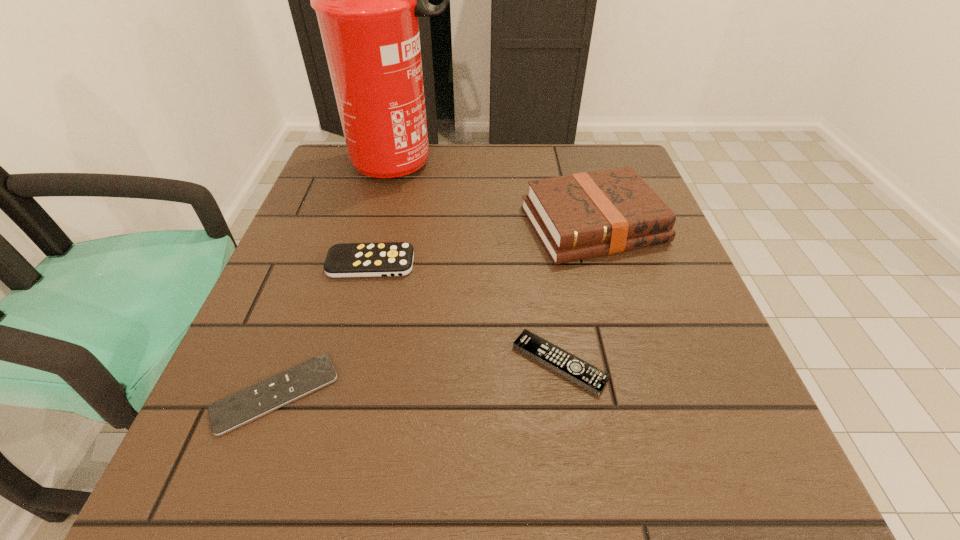
Where is `vacant position in the image that satisfies the following two spatial constraints: 1. on the trigger side of the hardback book; 2. on the left side of the fire extinguisher`? vacant position in the image that satisfies the following two spatial constraints: 1. on the trigger side of the hardback book; 2. on the left side of the fire extinguisher is located at coordinates (388, 225).

The height and width of the screenshot is (540, 960). In order to click on free spot that satisfies the following two spatial constraints: 1. on the back side of the hardback book; 2. on the trigger side of the farthest object in this screenshot , I will do `click(575, 164)`.